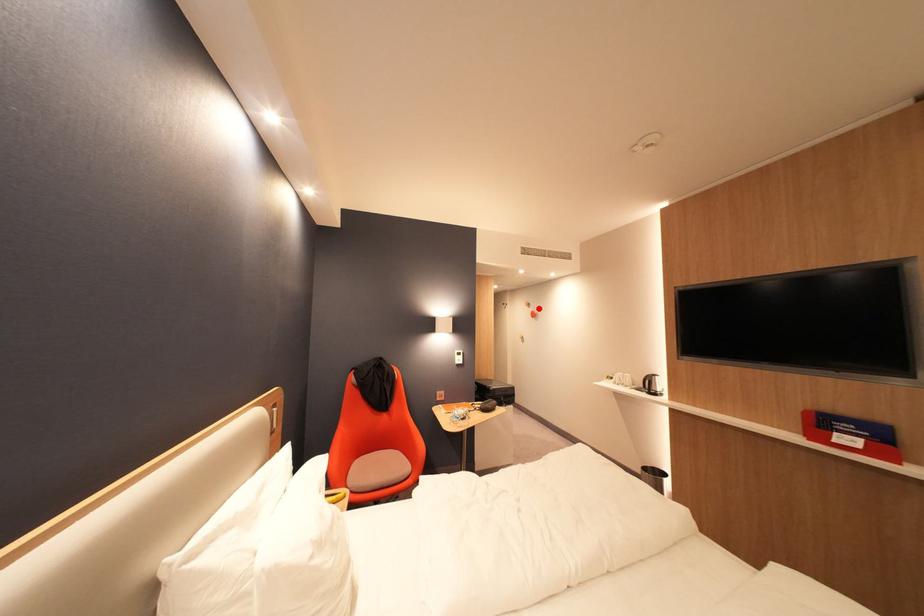
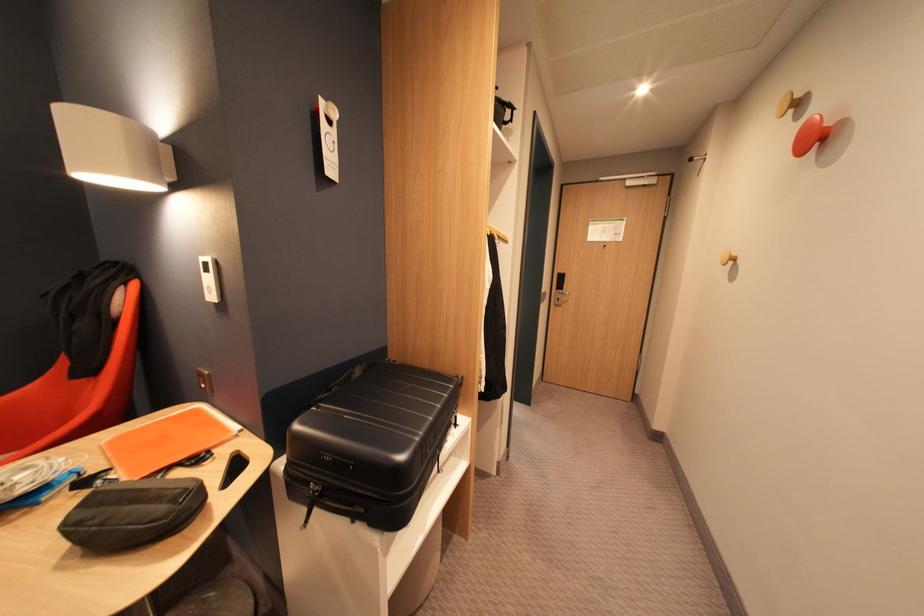
The point at the highlighted location is marked in the first image. Where is the corresponding point in the second image?

(809, 118)